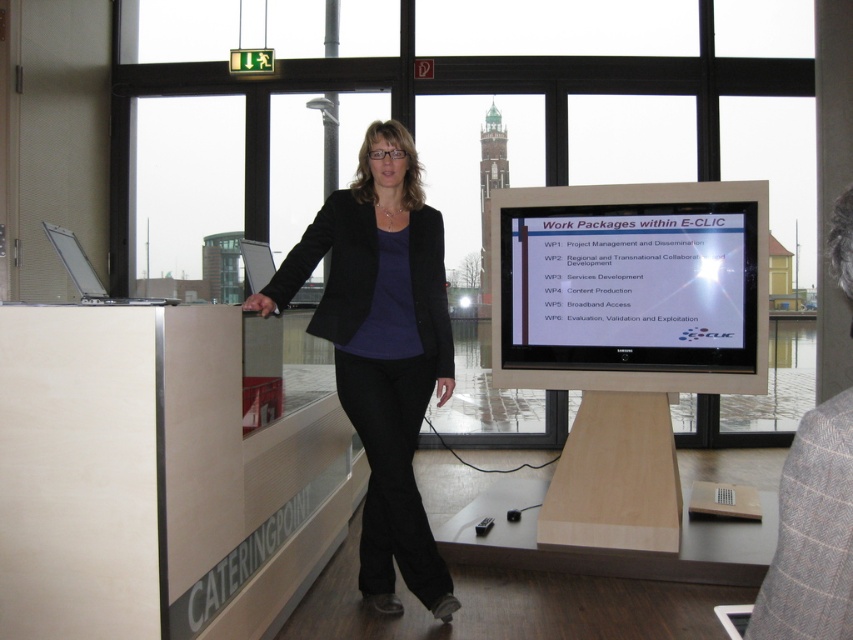
You are an attendee at the presentation and want to take a photo of the slide on the matte black monitor at center. However, the matte black blazer at center is blocking your view. Can you move to the right side of the room to get an unobstructed view? Explain why or why not based on their positions.

The matte black monitor at center is located above the matte black blazer at center. Since the monitor is above the blazer, moving to the right side of the room would still allow you to see the monitor as long as the blazer isn not directly blocking the line of sight. However, if the presenter is standing in front of the monitor, moving to the side might provide a better angle to avoid obstruction.